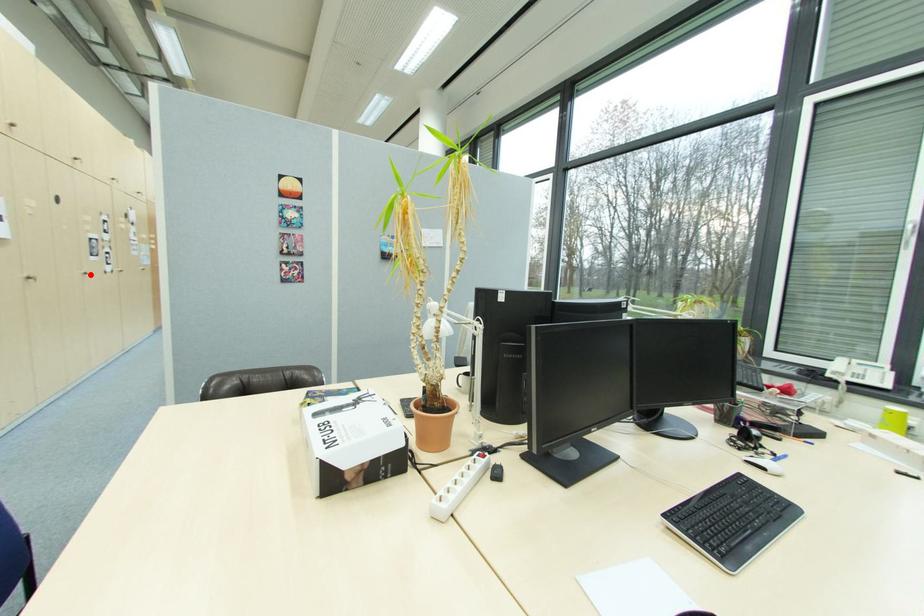
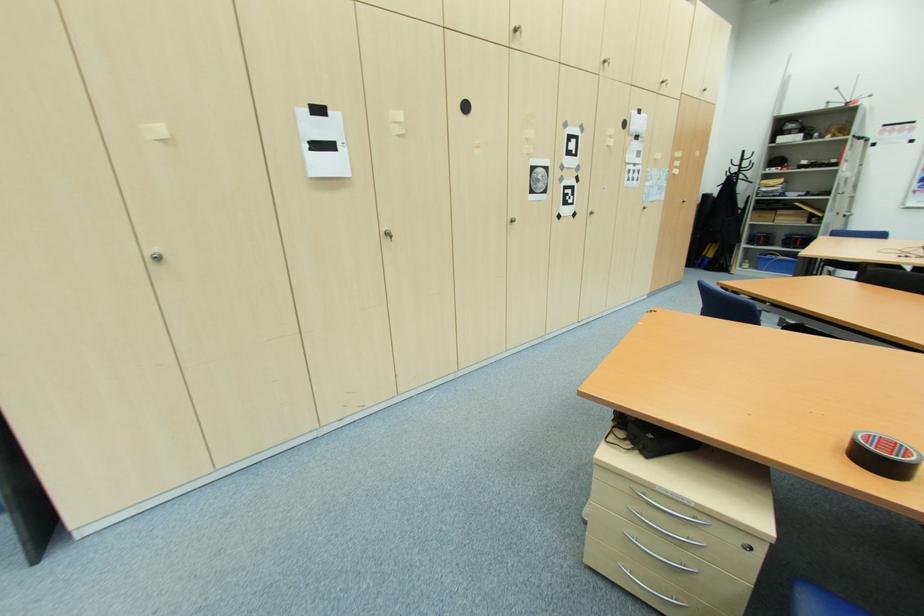
The point at the highlighted location is marked in the first image. Where is the corresponding point in the second image?

(517, 222)